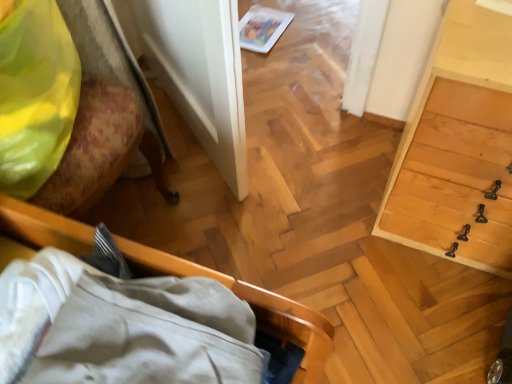
Locate an element on the screen. The width and height of the screenshot is (512, 384). free area in between light wood dresser at right and wooden chair at left, positioned as the second furniture in right-to-left order is located at coordinates (291, 208).